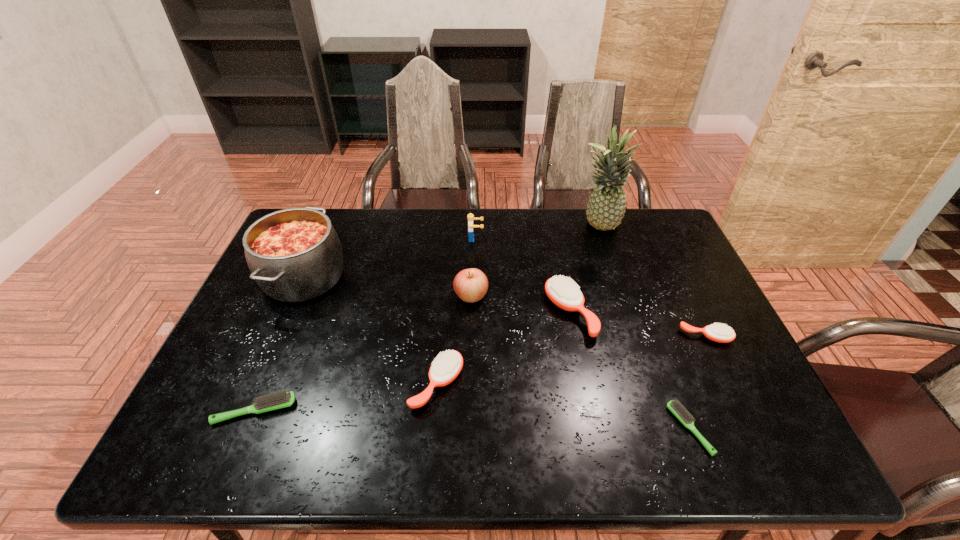
Locate an element on the screen. free spot located 0.250m on the right of the biggest orange hairbrush is located at coordinates (683, 313).

The image size is (960, 540). Identify the location of blank space located 0.330m on the right of the second tallest hairbrush. (600, 384).

You are a GUI agent. You are given a task and a screenshot of the screen. Output one action in this format:
    pyautogui.click(x=<x>, y=<y>)
    Task: Click on the free spot located on the back of the rightmost object
    
    Given the screenshot: What is the action you would take?
    pyautogui.click(x=660, y=240)

The height and width of the screenshot is (540, 960). What are the coordinates of `vacant area located on the back of the fourth tallest hairbrush` in the screenshot? It's located at click(x=291, y=324).

Where is `vacant space situated on the right of the shortest hairbrush`? vacant space situated on the right of the shortest hairbrush is located at coordinates (729, 429).

I want to click on pineapple present at the far edge, so click(x=606, y=207).

Identify the location of casserole located in the far edge section of the desktop. point(294,254).

At what (x,y) coordinates should I click in order to perform the action: click on Lego present at the far edge. Please return your answer as a coordinate pair (x, y). The width and height of the screenshot is (960, 540). Looking at the image, I should click on (470, 216).

The image size is (960, 540). I want to click on casserole located at the left edge, so click(x=294, y=254).

At what (x,y) coordinates should I click in order to perform the action: click on hairbrush located at the left edge. Please return your answer as a coordinate pair (x, y). Looking at the image, I should click on (281, 399).